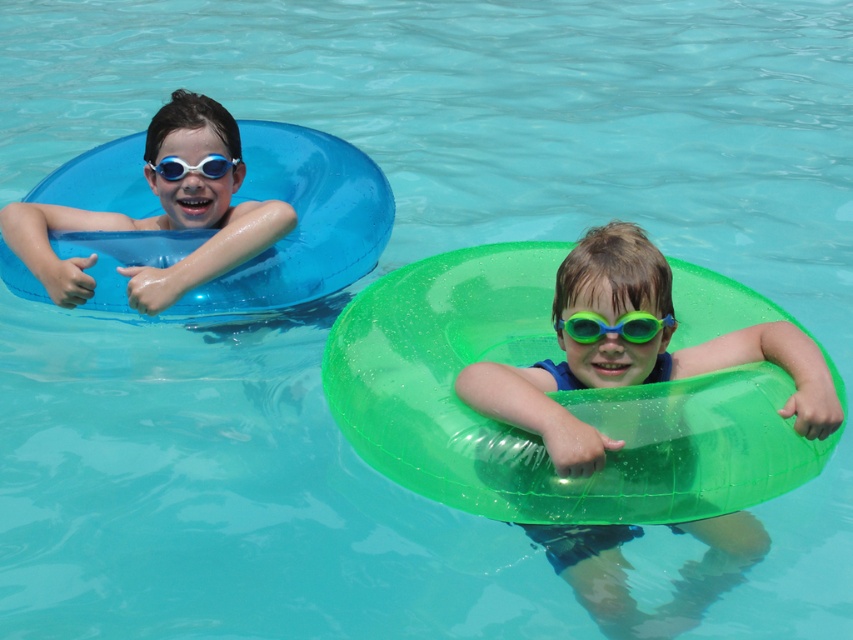
Question: Observing the image, what is the correct spatial positioning of green translucent tube at right in reference to blue rubber goggles at left?

Choices:
 (A) below
 (B) above

Answer: (A)

Question: Which point is closer to the camera?

Choices:
 (A) matte blue swim ring at left
 (B) green rubber goggles at center
 (C) green translucent tube at right
 (D) blue rubber goggles at left

Answer: (C)

Question: Which of the following is the farthest from the observer?

Choices:
 (A) matte blue swim ring at left
 (B) green rubber goggles at center

Answer: (A)

Question: Which object appears closest to the camera in this image?

Choices:
 (A) green translucent tube at right
 (B) matte blue swim ring at left
 (C) blue rubber goggles at left

Answer: (A)

Question: Where is green translucent tube at right located in relation to green rubber goggles at center in the image?

Choices:
 (A) left
 (B) right

Answer: (B)

Question: Can you confirm if matte blue swim ring at left is smaller than blue rubber goggles at left?

Choices:
 (A) yes
 (B) no

Answer: (B)